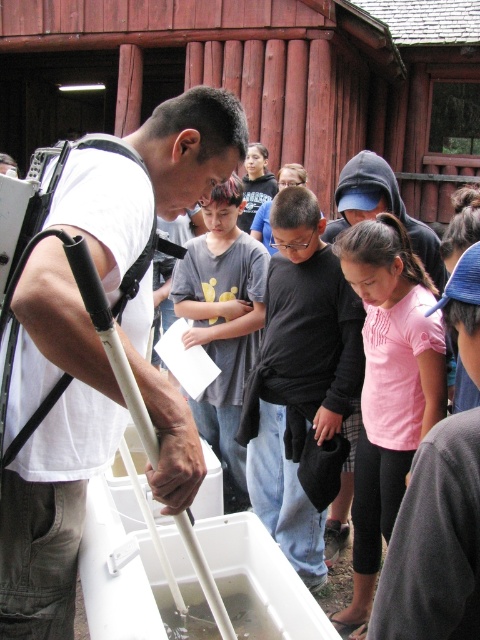
Question: Which of these objects is positioned closest to the black matte shirt at center?

Choices:
 (A) white matte crutch at left
 (B) gray cotton shirt at center
 (C) pink cotton shirt at center

Answer: (C)

Question: Is black matte shirt at center bigger than pink cotton shirt at center?

Choices:
 (A) no
 (B) yes

Answer: (B)

Question: Among these objects, which one is nearest to the camera?

Choices:
 (A) white matte crutch at left
 (B) black matte shirt at center
 (C) gray cotton shirt at center

Answer: (A)

Question: Is black matte shirt at center thinner than pink cotton shirt at center?

Choices:
 (A) yes
 (B) no

Answer: (B)

Question: Does white matte crutch at left have a smaller size compared to pink cotton shirt at center?

Choices:
 (A) no
 (B) yes

Answer: (A)

Question: Which point is closer to the camera?

Choices:
 (A) black matte shirt at center
 (B) pink cotton shirt at center
 (C) white matte crutch at left
 (D) gray cotton shirt at center

Answer: (C)